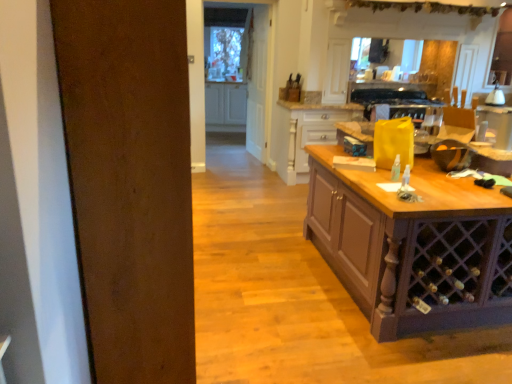
You are a GUI agent. You are given a task and a screenshot of the screen. Output one action in this format:
    pyautogui.click(x=<x>, y=<y>)
    Task: Click on the free region on the left part of wooden drawer at center, placed as the 1th cabinetry when sorted from front to back
    
    Given the screenshot: What is the action you would take?
    pyautogui.click(x=256, y=178)